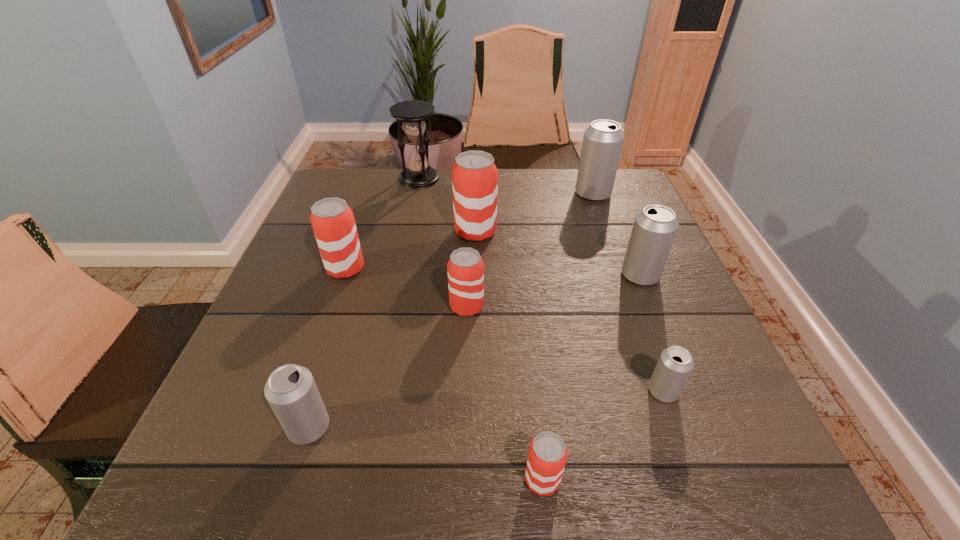
Where is `black hourglass`? The image size is (960, 540). black hourglass is located at coordinates (418, 175).

Identify the location of hourglass. This screenshot has height=540, width=960. (418, 175).

At what (x,y) coordinates should I click in order to perform the action: click on the biggest white beer can. Please return your answer as a coordinate pair (x, y). The width and height of the screenshot is (960, 540). Looking at the image, I should click on (602, 143).

This screenshot has height=540, width=960. Find the location of `the farthest beer can`. the farthest beer can is located at coordinates (602, 143).

Identify the location of the farthest orange beer can. The height and width of the screenshot is (540, 960). (474, 175).

The width and height of the screenshot is (960, 540). What are the coordinates of `the second farthest beer can` in the screenshot? It's located at (474, 175).

Where is `the leftmost orange beer can`? The image size is (960, 540). the leftmost orange beer can is located at coordinates (333, 223).

Identify the location of the third nearest orange beer can. (333, 223).

Where is `the second farthest white beer can`? This screenshot has width=960, height=540. the second farthest white beer can is located at coordinates (654, 229).

The height and width of the screenshot is (540, 960). Identify the location of the sixth farthest object. (465, 269).